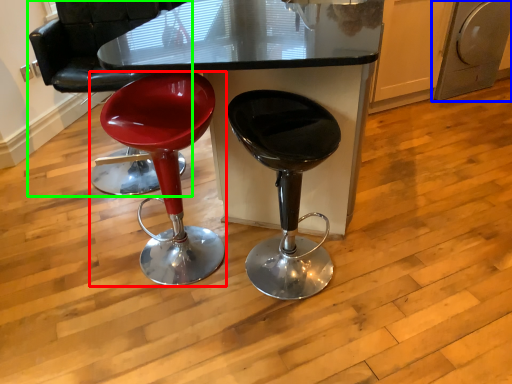
Question: Which is farther away from stool (highlighted by a red box)? dish washer (highlighted by a blue box) or chair (highlighted by a green box)?

Choices:
 (A) dish washer
 (B) chair

Answer: (A)